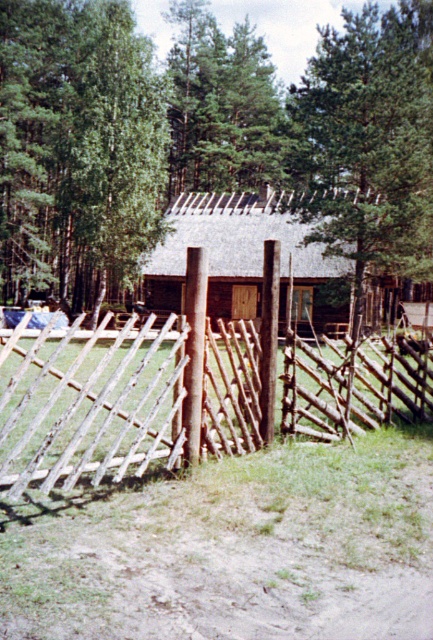
Question: Is green leafy tree at upper center in front of brown wooden log cabin at center?

Choices:
 (A) yes
 (B) no

Answer: (A)

Question: Is rustic wooden gate at center to the left of green leafy tree at center from the viewer's perspective?

Choices:
 (A) yes
 (B) no

Answer: (B)

Question: Among these points, which one is farthest from the camera?

Choices:
 (A) (6, 460)
 (B) (116, 278)
 (C) (316, 58)

Answer: (C)

Question: Can you confirm if rustic wooden gate at center is thinner than green leafy tree at upper center?

Choices:
 (A) no
 (B) yes

Answer: (A)

Question: Which point is farther to the camera?

Choices:
 (A) brown wooden log cabin at center
 (B) green leafy tree at center
 (C) green matte tree at upper center

Answer: (C)

Question: Based on their relative distances, which object is nearer to the green matte tree at upper center?

Choices:
 (A) green leafy tree at upper center
 (B) green leafy tree at center
 (C) rustic wooden gate at center

Answer: (B)